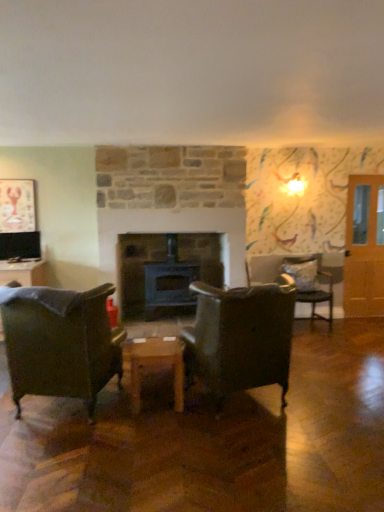
Find the location of a particular element. The height and width of the screenshot is (512, 384). black matte fireplace at center is located at coordinates (165, 272).

What do you see at coordinates (60, 343) in the screenshot? I see `leather armchair at left, acting as the 2th chair starting from the front` at bounding box center [60, 343].

The image size is (384, 512). I want to click on leather at center, the second chair when ordered from right to left, so click(x=241, y=338).

What do you see at coordinates (154, 365) in the screenshot?
I see `wooden table at center` at bounding box center [154, 365].

Locate an element on the screen. This screenshot has height=512, width=384. matte black tv at left is located at coordinates (20, 245).

I want to click on black matte fireplace at center, so click(165, 272).

Can you confirm if matte black tv at left is thinner than leather at center, which is the second chair from left to right?

Yes, matte black tv at left is thinner than leather at center, which is the second chair from left to right.

How many degrees apart are the facing directions of matte black tv at left and leather at center, which appears as the 1th chair when viewed from the front?

The facing directions of matte black tv at left and leather at center, which appears as the 1th chair when viewed from the front, are 172 degrees apart.

Choose the correct answer: Is matte black tv at left inside leather at center, the third chair in the back-to-front sequence, or outside it?

matte black tv at left exists outside the volume of leather at center, the third chair in the back-to-front sequence.

Which point is more forward, [35,237] or [211,368]?

The point [211,368] is in front.

Considering the relative sizes of wooden table at center and leather armchair at left, arranged as the 3th chair when viewed from the right, in the image provided, is wooden table at center taller than leather armchair at left, arranged as the 3th chair when viewed from the right,?

In fact, wooden table at center may be shorter than leather armchair at left, arranged as the 3th chair when viewed from the right.

From the image's perspective, is wooden table at center located beneath leather armchair at left, arranged as the 3th chair when viewed from the right?

Correct, wooden table at center appears lower than leather armchair at left, arranged as the 3th chair when viewed from the right, in the image.

Considering the positions of objects wooden table at center and leather armchair at left, the second chair when ordered from back to front, in the image provided, who is more to the left, wooden table at center or leather armchair at left, the second chair when ordered from back to front,?

From the viewer's perspective, leather armchair at left, the second chair when ordered from back to front, appears more on the left side.

Measure the distance from leather at center, the third chair in the back-to-front sequence, to gray fabric pillow at right.

leather at center, the third chair in the back-to-front sequence, and gray fabric pillow at right are 2.45 meters apart.

How different are the orientations of leather at center, which appears as the 1th chair when viewed from the front, and gray fabric pillow at right in degrees?

The angle between the facing direction of leather at center, which appears as the 1th chair when viewed from the front, and the facing direction of gray fabric pillow at right is 159 degrees.

Considering the sizes of leather at center, which appears as the 1th chair when viewed from the front, and gray fabric pillow at right in the image, is leather at center, which appears as the 1th chair when viewed from the front, taller or shorter than gray fabric pillow at right?

Considering their sizes, leather at center, which appears as the 1th chair when viewed from the front, has more height than gray fabric pillow at right.

From a real-world perspective, is leather at center, the third chair in the back-to-front sequence, physically below gray fabric pillow at right?

Indeed, from a real-world perspective, leather at center, the third chair in the back-to-front sequence, is positioned beneath gray fabric pillow at right.

Could you tell me if leather at center, the third chair in the back-to-front sequence, is facing black matte fireplace at center?

Yes, leather at center, the third chair in the back-to-front sequence, faces towards black matte fireplace at center.

From a real-world perspective, is leather at center, the third chair in the back-to-front sequence, positioned above or below black matte fireplace at center?

From a real-world perspective, leather at center, the third chair in the back-to-front sequence, is physically below black matte fireplace at center.

Locate an element on the screen. The image size is (384, 512). fireplace above the leather at center, the second chair when ordered from right to left (from the image's perspective) is located at coordinates (165, 272).

Is leather at center, which is the second chair from left to right, in contact with black matte fireplace at center?

leather at center, which is the second chair from left to right, and black matte fireplace at center are clearly separated.

Based on the photo, between matte black tv at left and black matte fireplace at center, which one appears on the right side from the viewer's perspective?

black matte fireplace at center is more to the right.

From the picture: In terms of height, does matte black tv at left look taller or shorter compared to black matte fireplace at center?

Considering their sizes, matte black tv at left has less height than black matte fireplace at center.

In the scene shown: From the image's perspective, which is above, matte black tv at left or black matte fireplace at center?

matte black tv at left is shown above in the image.

Based on their sizes in the image, would you say matte black tv at left is bigger or smaller than black matte fireplace at center?

matte black tv at left is smaller than black matte fireplace at center.

Is gray fabric pillow at right positioned behind metallic lobster picture frame at upper left?

That is True.

From a real-world perspective, is gray fabric pillow at right physically below metallic lobster picture frame at upper left?

Indeed, from a real-world perspective, gray fabric pillow at right is positioned beneath metallic lobster picture frame at upper left.

Considering the sizes of objects gray fabric pillow at right and metallic lobster picture frame at upper left in the image provided, who is bigger, gray fabric pillow at right or metallic lobster picture frame at upper left?

gray fabric pillow at right.

Which of these two, wooden table at center or metallic lobster picture frame at upper left, stands taller?

metallic lobster picture frame at upper left.

Between wooden table at center and metallic lobster picture frame at upper left, which one has larger size?

Bigger between the two is wooden table at center.

Does point (128, 355) appear closer or farther from the camera than point (8, 214)?

Point (128, 355) appears to be closer to the viewer than point (8, 214).

Find the location of a particular element. The height and width of the screenshot is (512, 384). chair that is the 2nd object located below the matte black tv at left (from the image's perspective) is located at coordinates (241, 338).

In the image, there is a leather armchair at left, arranged as the 3th chair when viewed from the right. Where is `table below it (from a real-world perspective)`? Image resolution: width=384 pixels, height=512 pixels. table below it (from a real-world perspective) is located at coordinates (154, 365).

Estimate the real-world distances between objects in this image. Which object is closer to velvet cushioned chair at right, which ranks as the 1th chair in right-to-left order, black matte fireplace at center or matte black tv at left?

black matte fireplace at center lies closer to velvet cushioned chair at right, which ranks as the 1th chair in right-to-left order, than the other object.

Based on their spatial positions, is leather at center, the second chair when ordered from right to left, or leather armchair at left, arranged as the 3th chair when viewed from the right, further from velvet cushioned chair at right, which is the third chair in left-to-right order?

Based on the image, leather armchair at left, arranged as the 3th chair when viewed from the right, appears to be further to velvet cushioned chair at right, which is the third chair in left-to-right order.

Looking at the image, which one is located closer to leather armchair at left, which is the 1th chair in left-to-right order, leather at center, which appears as the 1th chair when viewed from the front, or gray fabric pillow at right?

Based on the image, leather at center, which appears as the 1th chair when viewed from the front, appears to be nearer to leather armchair at left, which is the 1th chair in left-to-right order.

When comparing their distances from black matte fireplace at center, does translucent wooden door at right or matte black tv at left seem closer?

The object closer to black matte fireplace at center is matte black tv at left.

Consider the image. Estimate the real-world distances between objects in this image. Which object is further from leather armchair at left, acting as the 2th chair starting from the front, leather at center, which appears as the 1th chair when viewed from the front, or velvet cushioned chair at right, the first chair when ordered from back to front?

Based on the image, velvet cushioned chair at right, the first chair when ordered from back to front, appears to be further to leather armchair at left, acting as the 2th chair starting from the front.

Considering their positions, is wooden table at center positioned closer to black matte fireplace at center than leather armchair at left, the second chair when ordered from back to front?

Among the two, wooden table at center is located nearer to black matte fireplace at center.

When comparing their distances from black matte fireplace at center, does leather at center, the second chair when ordered from right to left, or wooden table at center seem closer?

wooden table at center is positioned closer to the anchor black matte fireplace at center.

Estimate the real-world distances between objects in this image. Which object is further from matte black tv at left, leather armchair at left, the second chair when ordered from back to front, or metallic lobster picture frame at upper left?

leather armchair at left, the second chair when ordered from back to front, lies further to matte black tv at left than the other object.

In order to click on pillow between matte black tv at left and velvet cushioned chair at right, which ranks as the 1th chair in right-to-left order, from left to right in this screenshot , I will do `click(302, 272)`.

You are a GUI agent. You are given a task and a screenshot of the screen. Output one action in this format:
    pyautogui.click(x=<x>, y=<y>)
    Task: Click on the table between matte black tv at left and gray fabric pillow at right from left to right
    
    Given the screenshot: What is the action you would take?
    pyautogui.click(x=154, y=365)

You are a GUI agent. You are given a task and a screenshot of the screen. Output one action in this format:
    pyautogui.click(x=<x>, y=<y>)
    Task: Click on the fireplace located between leather at center, which appears as the 1th chair when viewed from the front, and gray fabric pillow at right in the depth direction
    
    Given the screenshot: What is the action you would take?
    pyautogui.click(x=165, y=272)

At what (x,y) coordinates should I click in order to perform the action: click on pillow situated between leather armchair at left, the second chair when ordered from back to front, and translucent wooden door at right from left to right. Please return your answer as a coordinate pair (x, y). This screenshot has width=384, height=512. Looking at the image, I should click on (302, 272).